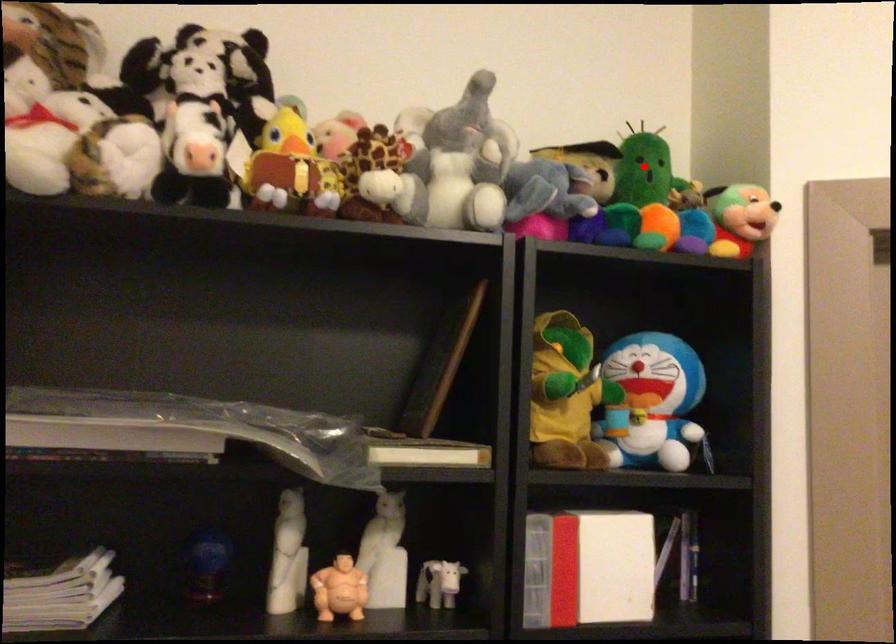
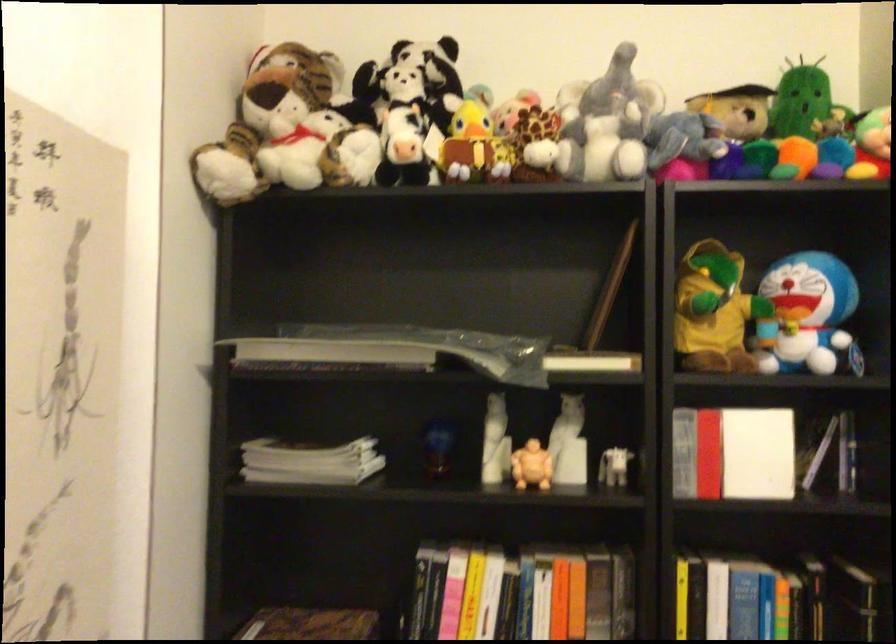
Find the pixel in the second image that matches the highlighted location in the first image.

(799, 100)